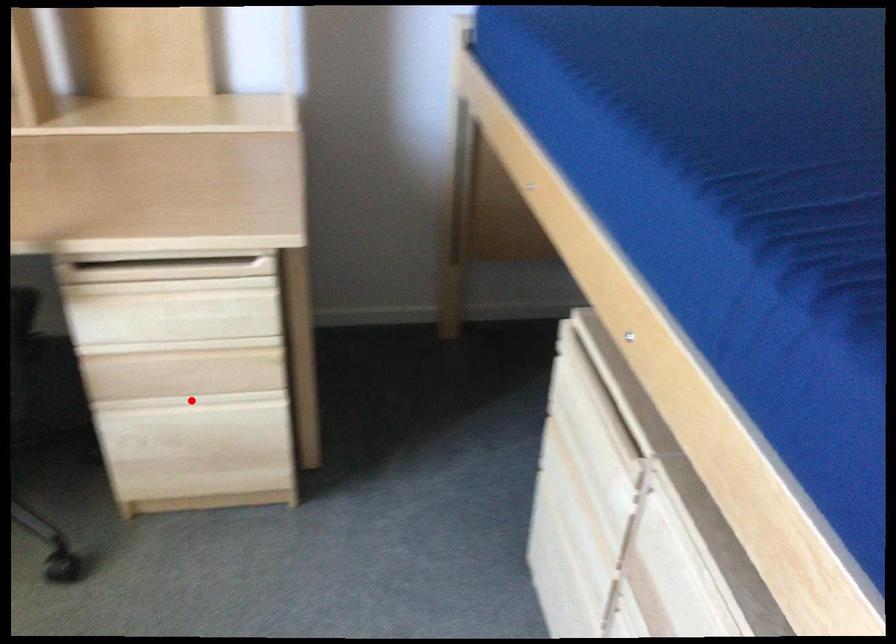
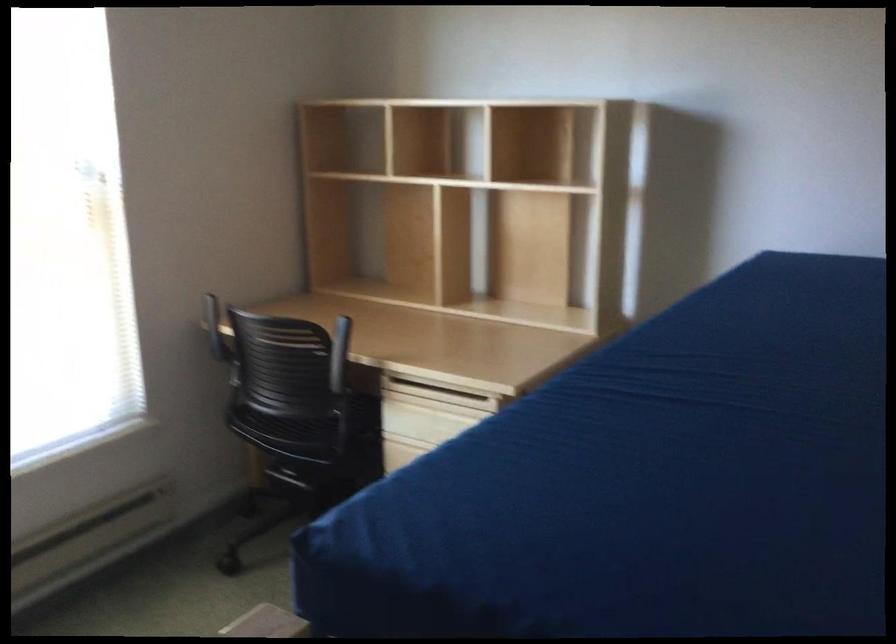
Question: I am providing you with two images of the same scene from different viewpoints. A red point is marked on the first image. Can you still see the location of the red point in image 2?

Choices:
 (A) Yes
 (B) No

Answer: (B)